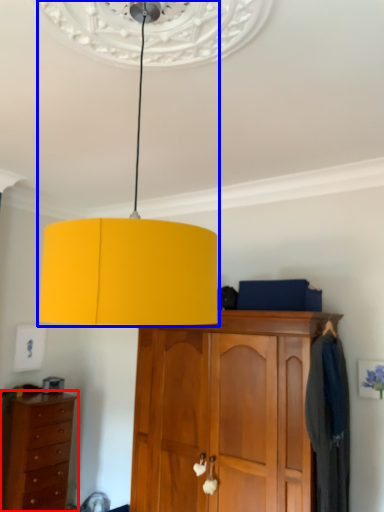
Question: Which of the following is the farthest to the observer, chest of drawers (highlighted by a red box) or lamp (highlighted by a blue box)?

Choices:
 (A) chest of drawers
 (B) lamp

Answer: (A)